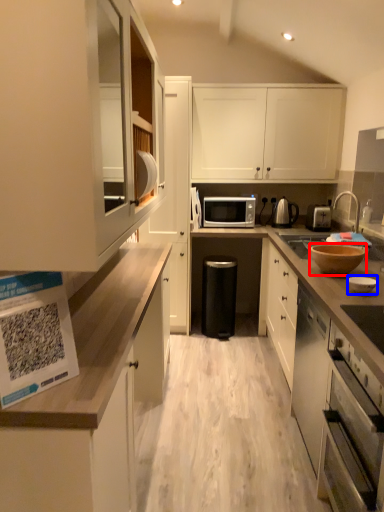
Question: Which object is further to the camera taking this photo, bowl (highlighted by a red box) or bowl (highlighted by a blue box)?

Choices:
 (A) bowl
 (B) bowl

Answer: (A)